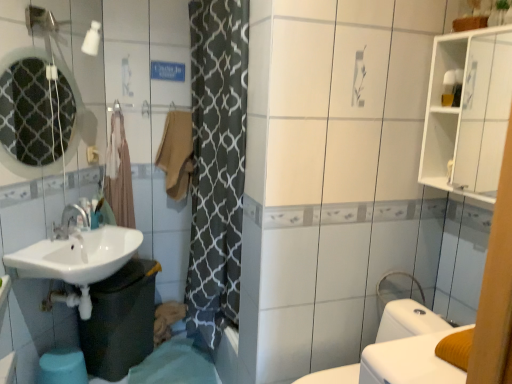
Question: From the image's perspective, is beige fabric towel at center above or below white glossy bidet at lower right?

Choices:
 (A) below
 (B) above

Answer: (B)

Question: Relative to white glossy bidet at lower right, is beige fabric towel at center in front or behind?

Choices:
 (A) front
 (B) behind

Answer: (B)

Question: Considering the real-world distances, which object is closest to the matte glass mirror at upper left?

Choices:
 (A) white glossy medicine cabinet at upper right
 (B) white glossy sink at lower left
 (C) beige fabric towel at center
 (D) brown fabric shower curtain at left
 (E) white glossy bidet at lower right

Answer: (D)

Question: Considering the real-world distances, which object is closest to the white glossy sink at lower left?

Choices:
 (A) beige fabric towel at center
 (B) white glossy medicine cabinet at upper right
 (C) white glossy bidet at lower right
 (D) matte glass mirror at upper left
 (E) brown fabric shower curtain at left

Answer: (E)